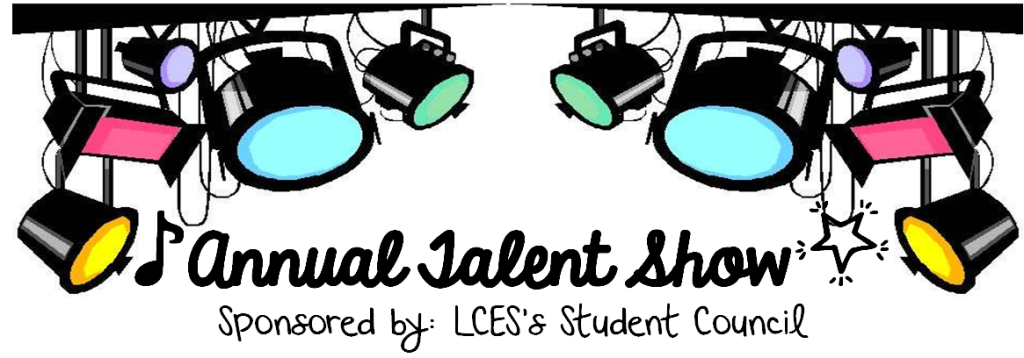
Locate an element on the screen. purple light is located at coordinates (171, 64).